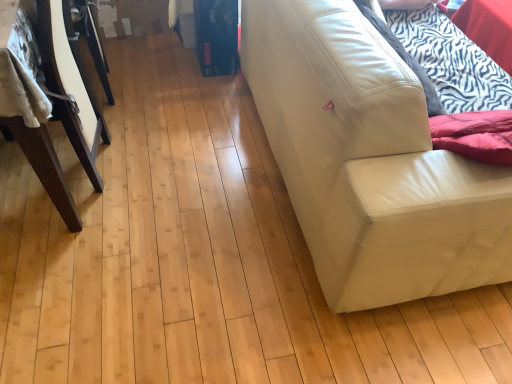
Question: Is dark brown wood table at left in front of or behind white leather couch at right in the image?

Choices:
 (A) front
 (B) behind

Answer: (B)

Question: Is point 53,49 closer or farther from the camera than point 452,274?

Choices:
 (A) closer
 (B) farther

Answer: (B)

Question: Looking at their shapes, would you say dark brown wood table at left is wider or thinner than white leather couch at right?

Choices:
 (A) wide
 (B) thin

Answer: (A)

Question: Relative to dark brown wood table at left, is white leather couch at right in front or behind?

Choices:
 (A) front
 (B) behind

Answer: (A)

Question: Do you think white leather couch at right is within dark brown wood table at left, or outside of it?

Choices:
 (A) inside
 (B) outside

Answer: (B)

Question: Is point (386, 208) positioned closer to the camera than point (57, 185)?

Choices:
 (A) farther
 (B) closer

Answer: (B)

Question: From the image's perspective, is white leather couch at right above or below dark brown wood table at left?

Choices:
 (A) above
 (B) below

Answer: (B)